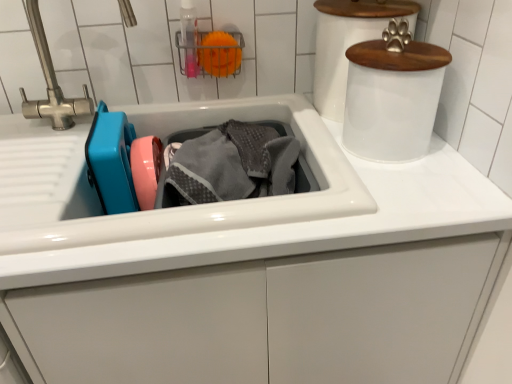
Question: Does point (390, 49) appear closer or farther from the camera than point (68, 221)?

Choices:
 (A) farther
 (B) closer

Answer: (A)

Question: Relative to white glossy sink at center, is white frosted plastic canister at upper right, the first appliance from the front, in front or behind?

Choices:
 (A) behind
 (B) front

Answer: (A)

Question: Considering the real-world distances, which object is closest to the transparent plastic bottle at upper center?

Choices:
 (A) gray terry towel at center
 (B) white frosted plastic canister at upper right, which ranks as the second appliance in back-to-front order
 (C) white glossy sink at center
 (D) white glossy paw print at upper right, which ranks as the 2th appliance in front-to-back order

Answer: (A)

Question: Considering the real-world distances, which object is closest to the transparent plastic bottle at upper center?

Choices:
 (A) white frosted plastic canister at upper right, the first appliance from the front
 (B) white glossy paw print at upper right, placed as the 1th appliance when sorted from back to front
 (C) gray terry towel at center
 (D) white glossy sink at center

Answer: (C)